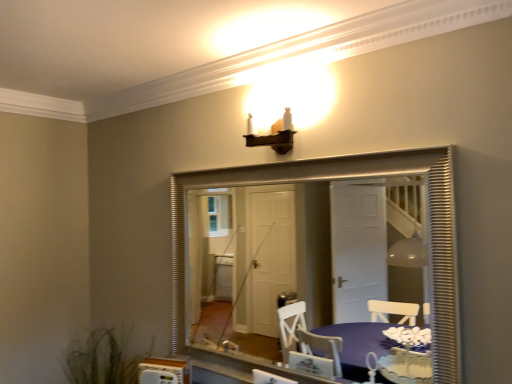
What are the coordinates of `silver textured mirror at center` in the screenshot? It's located at (359, 266).

Locate an element on the screen. The height and width of the screenshot is (384, 512). green grass at lower left is located at coordinates click(x=102, y=359).

Is green grass at lower left spatially inside purple fabric table at lower center, or outside of it?

green grass at lower left exists outside the volume of purple fabric table at lower center.

From their relative heights in the image, would you say green grass at lower left is taller or shorter than purple fabric table at lower center?

In the image, green grass at lower left appears to be taller than purple fabric table at lower center.

Is point (112, 371) more distant than point (353, 375)?

No, it is in front of (353, 375).

Is green grass at lower left positioned with its back to silver textured mirror at center?

No.

Would you say green grass at lower left is inside or outside silver textured mirror at center?

green grass at lower left is spatially situated outside silver textured mirror at center.

In the scene shown: Is green grass at lower left far from silver textured mirror at center?

Yes, green grass at lower left and silver textured mirror at center are quite far apart.

Identify the location of plant that appears below the silver textured mirror at center (from a real-world perspective). (102, 359).

From a real-world perspective, which is physically below, purple fabric table at lower center or green grass at lower left?

In real-world perspective, green grass at lower left is lower.

Is purple fabric table at lower center not close to green grass at lower left?

purple fabric table at lower center is positioned a significant distance from green grass at lower left.

From the image's perspective, is purple fabric table at lower center below green grass at lower left?

No.

Is point (361, 351) farther from viewer compared to point (100, 368)?

Yes.

Considering the sizes of objects silver textured mirror at center and green grass at lower left in the image provided, who is wider, silver textured mirror at center or green grass at lower left?

Wider between the two is green grass at lower left.

Which of these two, silver textured mirror at center or green grass at lower left, is bigger?

green grass at lower left is bigger.

Which point is more distant from viewer, (384, 206) or (137, 373)?

Positioned behind is point (384, 206).

From a real-world perspective, is silver textured mirror at center over green grass at lower left?

Correct, in the physical world, silver textured mirror at center is higher than green grass at lower left.

Based on the photo, does purple fabric table at lower center have a lesser width compared to silver textured mirror at center?

In fact, purple fabric table at lower center might be wider than silver textured mirror at center.

Is purple fabric table at lower center facing away from silver textured mirror at center?

Yes, purple fabric table at lower center is facing away from silver textured mirror at center.

From the image's perspective, between purple fabric table at lower center and silver textured mirror at center, which one is located above?

From the image's view, silver textured mirror at center is above.

Based on the photo, is purple fabric table at lower center bigger than silver textured mirror at center?

Incorrect, purple fabric table at lower center is not larger than silver textured mirror at center.

Which object is positioned more to the left, silver textured mirror at center or purple fabric table at lower center?

From the viewer's perspective, silver textured mirror at center appears more on the left side.

From the picture: Is silver textured mirror at center wider or thinner than purple fabric table at lower center?

In the image, silver textured mirror at center appears to be more narrow than purple fabric table at lower center.

Is silver textured mirror at center surrounding purple fabric table at lower center?

No, purple fabric table at lower center is not a part of silver textured mirror at center.

From a real-world perspective, relative to purple fabric table at lower center, is silver textured mirror at center vertically above or below?

Clearly, from a real-world perspective, silver textured mirror at center is above purple fabric table at lower center.

You are a GUI agent. You are given a task and a screenshot of the screen. Output one action in this format:
    pyautogui.click(x=<x>, y=<y>)
    Task: Click on the plant behind the purple fabric table at lower center
    Image resolution: width=512 pixels, height=384 pixels.
    Given the screenshot: What is the action you would take?
    pyautogui.click(x=102, y=359)

This screenshot has height=384, width=512. Identify the location of plant below the silver textured mirror at center (from the image's perspective). (102, 359).

From the image, which object appears to be nearer to purple fabric table at lower center, silver textured mirror at center or green grass at lower left?

silver textured mirror at center lies closer to purple fabric table at lower center than the other object.

Estimate the real-world distances between objects in this image. Which object is closer to silver textured mirror at center, purple fabric table at lower center or green grass at lower left?

Based on the image, purple fabric table at lower center appears to be nearer to silver textured mirror at center.

From the picture: Considering their positions, is green grass at lower left positioned further to silver textured mirror at center than purple fabric table at lower center?

green grass at lower left is further to silver textured mirror at center.

When comparing their distances from purple fabric table at lower center, does green grass at lower left or silver textured mirror at center seem further?

green grass at lower left.

Looking at the image, which one is located closer to green grass at lower left, silver textured mirror at center or purple fabric table at lower center?

The object closer to green grass at lower left is purple fabric table at lower center.

Considering their positions, is purple fabric table at lower center positioned further to green grass at lower left than silver textured mirror at center?

silver textured mirror at center is further to green grass at lower left.

Where is `mirror between green grass at lower left and purple fabric table at lower center from left to right`? This screenshot has height=384, width=512. mirror between green grass at lower left and purple fabric table at lower center from left to right is located at coordinates tap(359, 266).